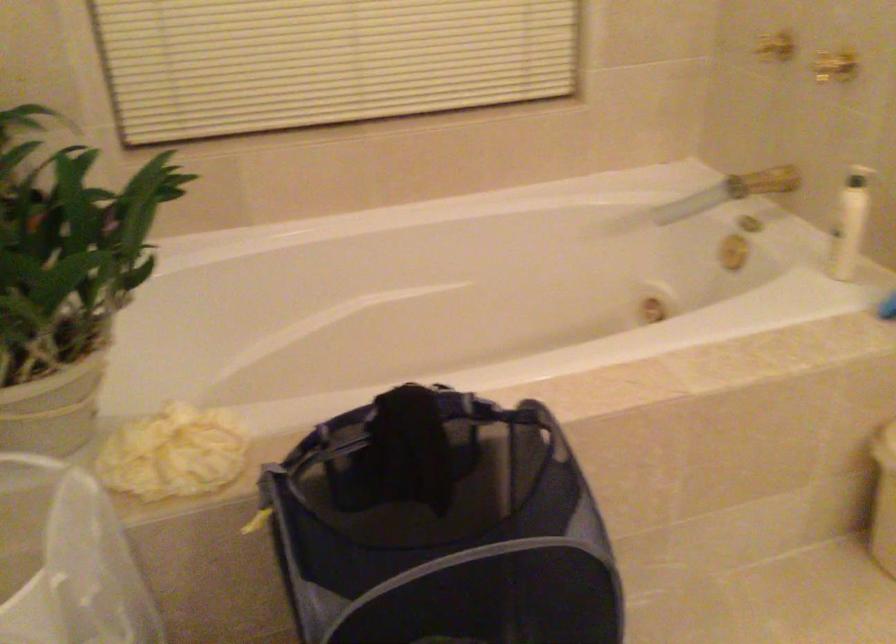
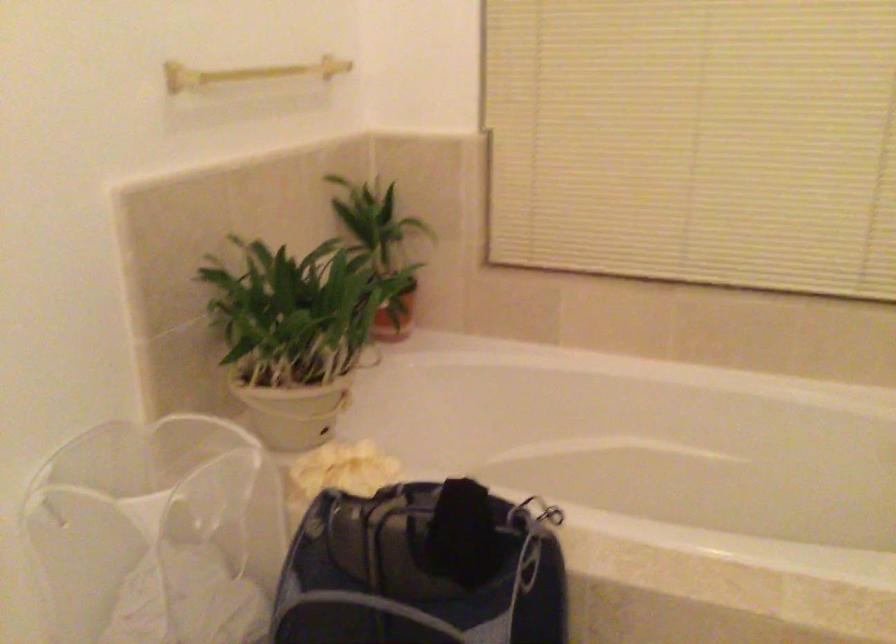
Question: The camera is either moving clockwise (left) or counter-clockwise (right) around the object. The first image is from the beginning of the video and the second image is from the end. Is the camera moving left or right when shooting the video?

Choices:
 (A) Left
 (B) Right

Answer: (B)